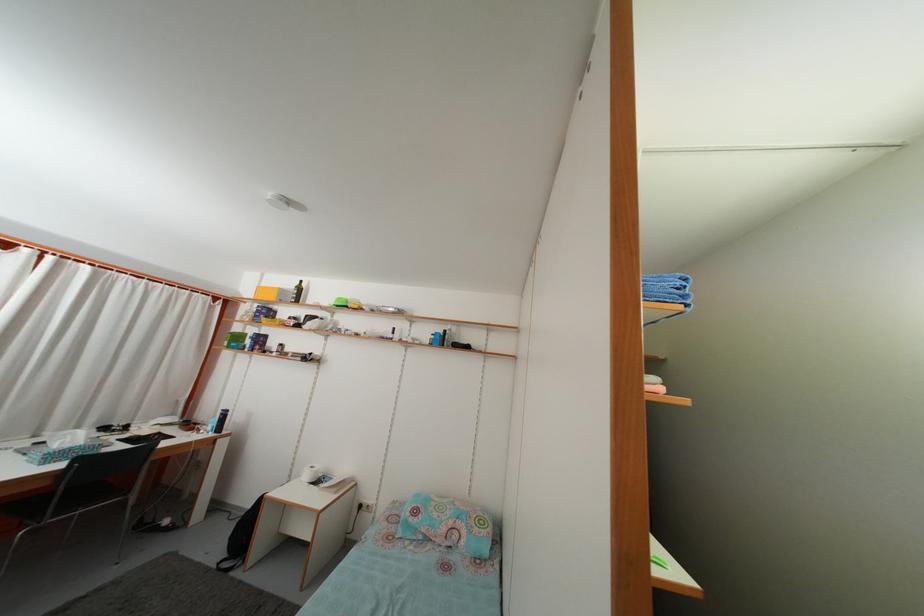
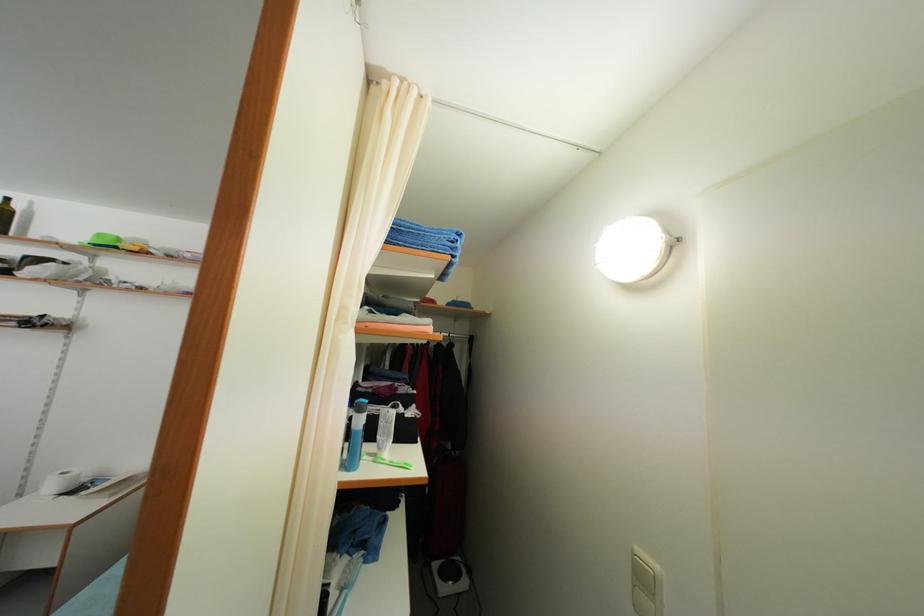
Question: The images are taken continuously from a first-person perspective. In which direction are you moving?

Choices:
 (A) Left
 (B) Right
 (C) Forward
 (D) Backward

Answer: (B)